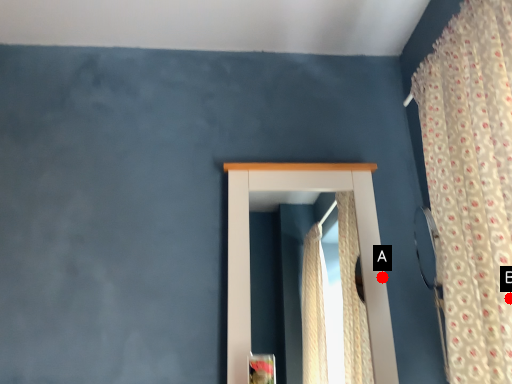
Question: Two points are circled on the image, labeled by A and B beside each circle. Among these points, which one is nearest to the camera?

Choices:
 (A) A is closer
 (B) B is closer

Answer: (B)